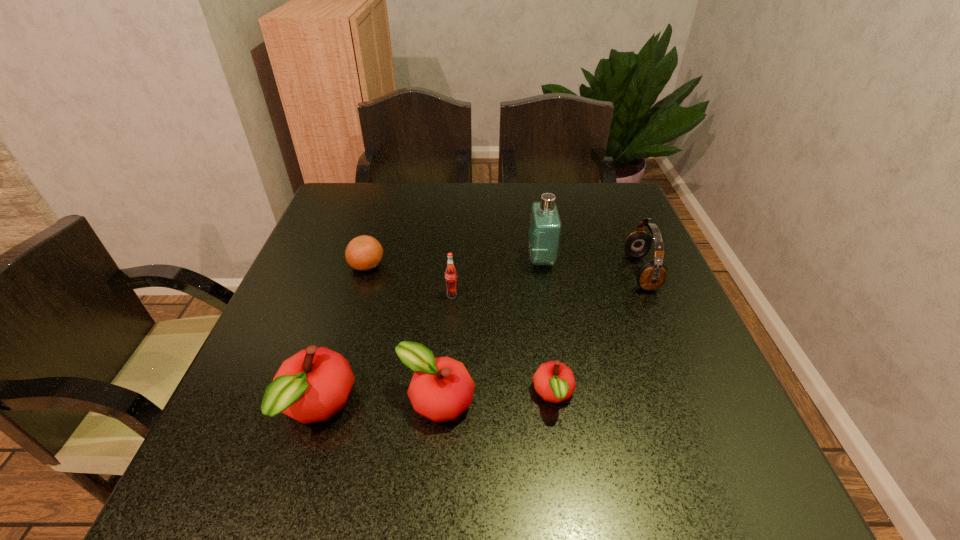
Identify the location of vacant region between the second shortest apple and the soda bottle. Image resolution: width=960 pixels, height=540 pixels. (444, 348).

The image size is (960, 540). I want to click on unoccupied position between the headset and the leftmost apple, so click(479, 340).

Identify the location of free point between the shortest apple and the soda bottle. This screenshot has width=960, height=540. (503, 345).

Where is `unoccupied position between the leftmost apple and the tallest object`? This screenshot has height=540, width=960. unoccupied position between the leftmost apple and the tallest object is located at coordinates (429, 333).

This screenshot has width=960, height=540. I want to click on vacant area that lies between the soda bottle and the headset, so click(x=546, y=284).

I want to click on empty space between the perfume and the rightmost apple, so click(x=547, y=327).

The width and height of the screenshot is (960, 540). Identify the location of free space between the clementine and the leftmost apple. (342, 336).

Locate an element on the screen. The height and width of the screenshot is (540, 960). free space that is in between the headset and the leftmost apple is located at coordinates (479, 340).

Where is `free area in between the soda bottle and the second tallest apple`? This screenshot has height=540, width=960. free area in between the soda bottle and the second tallest apple is located at coordinates (444, 348).

At what (x,y) coordinates should I click in order to perform the action: click on object that can be found as the fourth closest to the soda bottle. Please return your answer as a coordinate pair (x, y). Image resolution: width=960 pixels, height=540 pixels. Looking at the image, I should click on (311, 386).